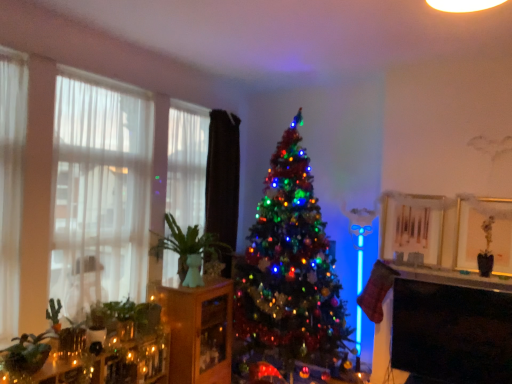
Question: In the image, is matte white shelf at lower right positioned in front of or behind matte glass candle at lower left?

Choices:
 (A) front
 (B) behind

Answer: (B)

Question: From the image's perspective, is matte white shelf at lower right positioned above or below matte glass candle at lower left?

Choices:
 (A) below
 (B) above

Answer: (B)

Question: Based on their relative distances, which object is farther from the matte glass candle at lower left?

Choices:
 (A) wooden cabinet at center
 (B) white sheer curtain at left, which appears as the 2th curtain when viewed from the right
 (C) matte white shelf at lower right
 (D) iridescent glass christmas tree at center
 (E) green ceramic vase at left

Answer: (C)

Question: Estimate the real-world distances between objects in this image. Which object is farther from the translucent fabric at left?

Choices:
 (A) green matte plant at lower left
 (B) iridescent glass christmas tree at center
 (C) matte glass candle at lower left
 (D) wooden cabinet at center
 (E) green ceramic vase at left

Answer: (B)